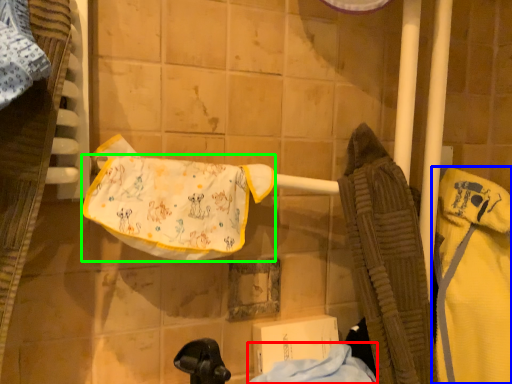
Question: Which object is positioned farthest from cloth (highlighted by a red box)? Select from bathrobe (highlighted by a blue box) and underclothes (highlighted by a green box).

Choices:
 (A) bathrobe
 (B) underclothes

Answer: (B)